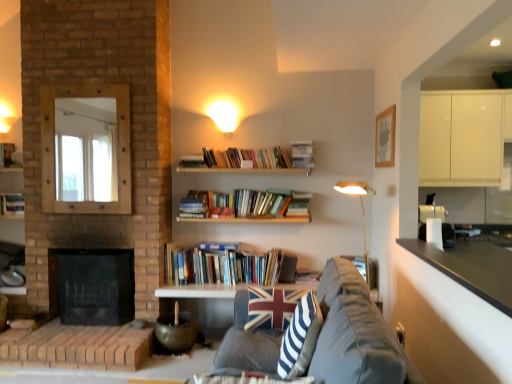
Question: Is wooden picture frame at upper right wider or thinner than blue and white striped fabric pillow at center?

Choices:
 (A) thin
 (B) wide

Answer: (A)

Question: Is wooden picture frame at upper right situated inside blue and white striped fabric pillow at center or outside?

Choices:
 (A) inside
 (B) outside

Answer: (B)

Question: Estimate the real-world distances between objects in this image. Which object is farther from the hardcover books at center, which is the third book from right to left?

Choices:
 (A) black granite countertop at lower right
 (B) wooden picture frame at upper right
 (C) dark gray fabric couch at center
 (D) white glossy table at center
 (E) white paper at upper center, positioned as the first book in top-to-bottom order

Answer: (A)

Question: Which object is the closest to the brick fireplace at left?

Choices:
 (A) white paper at upper center, which is the third book in left-to-right order
 (B) hardcover book at center, the 1th book positioned from the bottom
 (C) blue and white striped fabric pillow at center
 (D) white glossy table at center
 (E) dark gray fabric couch at center

Answer: (D)